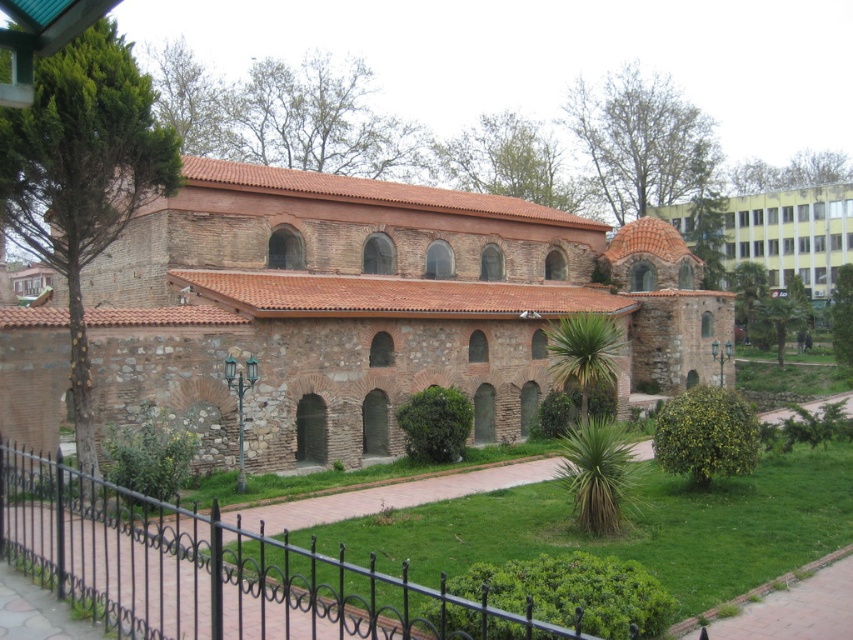
Question: Is brown stone chapel at center bigger than black wrought iron fence at lower left?

Choices:
 (A) yes
 (B) no

Answer: (A)

Question: Which point is closer to the camera taking this photo?

Choices:
 (A) (103, 400)
 (B) (192, 580)

Answer: (B)

Question: Which point is closer to the camera?

Choices:
 (A) (229, 584)
 (B) (548, 216)

Answer: (A)

Question: Is the position of brown stone chapel at center less distant than that of black wrought iron fence at lower left?

Choices:
 (A) no
 (B) yes

Answer: (A)

Question: Does brown stone chapel at center appear under black wrought iron fence at lower left?

Choices:
 (A) no
 (B) yes

Answer: (A)